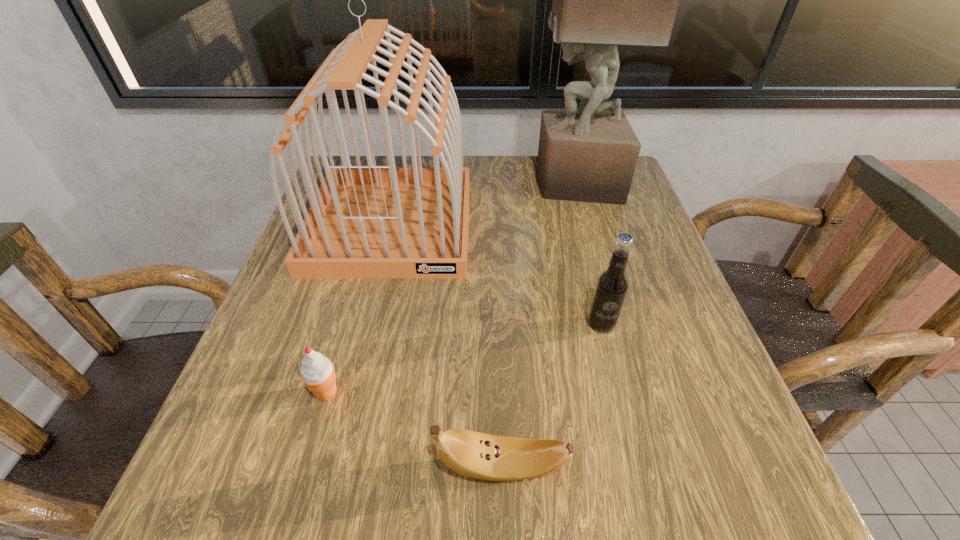
Image resolution: width=960 pixels, height=540 pixels. I want to click on vacant area that lies between the second nearest object and the birdcage, so click(359, 309).

This screenshot has height=540, width=960. Find the location of `empty space between the birdcage and the icecream`. empty space between the birdcage and the icecream is located at coordinates pyautogui.click(x=359, y=309).

What are the coordinates of `blank region between the sculpture and the root beer` in the screenshot? It's located at (588, 253).

You are a GUI agent. You are given a task and a screenshot of the screen. Output one action in this format:
    pyautogui.click(x=<x>, y=<y>)
    Task: Click on the empty location between the nearest object and the icecream
    Image resolution: width=960 pixels, height=540 pixels.
    Given the screenshot: What is the action you would take?
    pyautogui.click(x=415, y=430)

Where is `blank region between the nearest object and the third farthest object`? blank region between the nearest object and the third farthest object is located at coordinates (551, 396).

The image size is (960, 540). Find the location of `free space between the birdcage and the sculpture`. free space between the birdcage and the sculpture is located at coordinates tap(484, 204).

You are a GUI agent. You are given a task and a screenshot of the screen. Output one action in this format:
    pyautogui.click(x=<x>, y=<y>)
    Task: Click on the object that is the fourth closest one to the third nearest object
    This screenshot has height=540, width=960.
    Given the screenshot: What is the action you would take?
    pyautogui.click(x=317, y=372)

Where is `object that is the closest to the birdcage`? object that is the closest to the birdcage is located at coordinates 600,0.

I want to click on vacant space that satisfies the following two spatial constraints: 1. on the front-facing side of the sculpture; 2. with an open door on the birdcage, so click(588, 225).

Locate an element on the screen. The height and width of the screenshot is (540, 960). vacant space that satisfies the following two spatial constraints: 1. on the front-facing side of the sculpture; 2. on the label of the third tallest object is located at coordinates (616, 324).